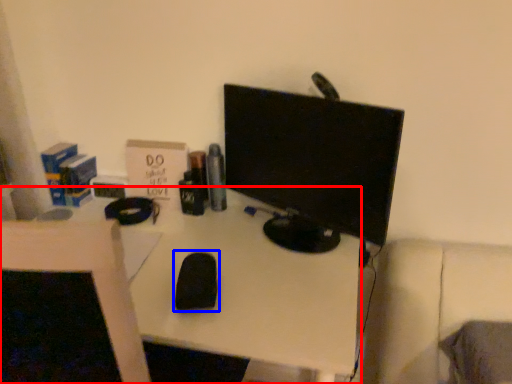
Question: Which of the following is the closest to the observer, desk (highlighted by a red box) or mouse (highlighted by a blue box)?

Choices:
 (A) desk
 (B) mouse

Answer: (A)